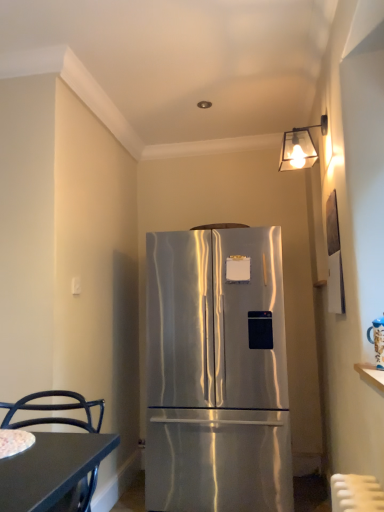
Question: Can you see black metal chair at lower left touching metallic glass lampshade at upper right?

Choices:
 (A) no
 (B) yes

Answer: (A)

Question: Is black metal chair at lower left located outside metallic glass lampshade at upper right?

Choices:
 (A) no
 (B) yes

Answer: (B)

Question: Considering the relative sizes of black metal chair at lower left and metallic glass lampshade at upper right in the image provided, is black metal chair at lower left bigger than metallic glass lampshade at upper right?

Choices:
 (A) yes
 (B) no

Answer: (A)

Question: From the image's perspective, would you say black metal chair at lower left is shown under metallic glass lampshade at upper right?

Choices:
 (A) yes
 (B) no

Answer: (A)

Question: Would you say metallic glass lampshade at upper right is part of black metal chair at lower left's contents?

Choices:
 (A) no
 (B) yes

Answer: (A)

Question: Does point (266, 406) appear closer or farther from the camera than point (309, 147)?

Choices:
 (A) closer
 (B) farther

Answer: (B)

Question: Would you say stainless steel refrigerator at center is inside or outside metallic glass lampshade at upper right?

Choices:
 (A) outside
 (B) inside

Answer: (A)

Question: Is stainless steel refrigerator at center bigger or smaller than metallic glass lampshade at upper right?

Choices:
 (A) big
 (B) small

Answer: (A)

Question: Is stainless steel refrigerator at center in front of or behind metallic glass lampshade at upper right in the image?

Choices:
 (A) behind
 (B) front

Answer: (A)

Question: Considering the positions of point (82, 398) and point (294, 153), is point (82, 398) closer or farther from the camera than point (294, 153)?

Choices:
 (A) closer
 (B) farther

Answer: (A)

Question: Considering the relative positions of black metal chair at lower left and metallic glass lampshade at upper right in the image provided, is black metal chair at lower left to the left or to the right of metallic glass lampshade at upper right?

Choices:
 (A) right
 (B) left

Answer: (B)

Question: Which is correct: black metal chair at lower left is inside metallic glass lampshade at upper right, or outside of it?

Choices:
 (A) inside
 (B) outside

Answer: (B)

Question: In terms of height, does black metal chair at lower left look taller or shorter compared to metallic glass lampshade at upper right?

Choices:
 (A) tall
 (B) short

Answer: (A)

Question: Would you say metallic glass lampshade at upper right is to the left or to the right of black metal chair at lower left in the picture?

Choices:
 (A) right
 (B) left

Answer: (A)

Question: In the image, is metallic glass lampshade at upper right positioned in front of or behind black metal chair at lower left?

Choices:
 (A) front
 (B) behind

Answer: (B)